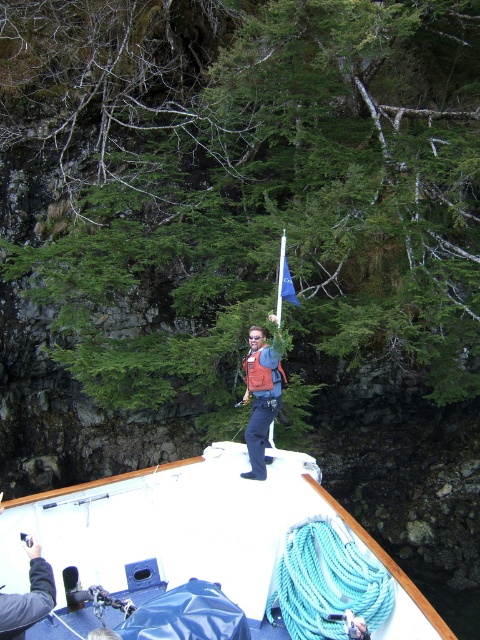
In the scene shown: Does white matte boat at center come behind orange life vest at center?

No, it is not.

Does white matte boat at center have a lesser width compared to orange life vest at center?

No.

Which is in front, point (121, 547) or point (253, 348)?

Point (121, 547) is in front.

Where is `white matte boat at center`? white matte boat at center is located at coordinates (201, 531).